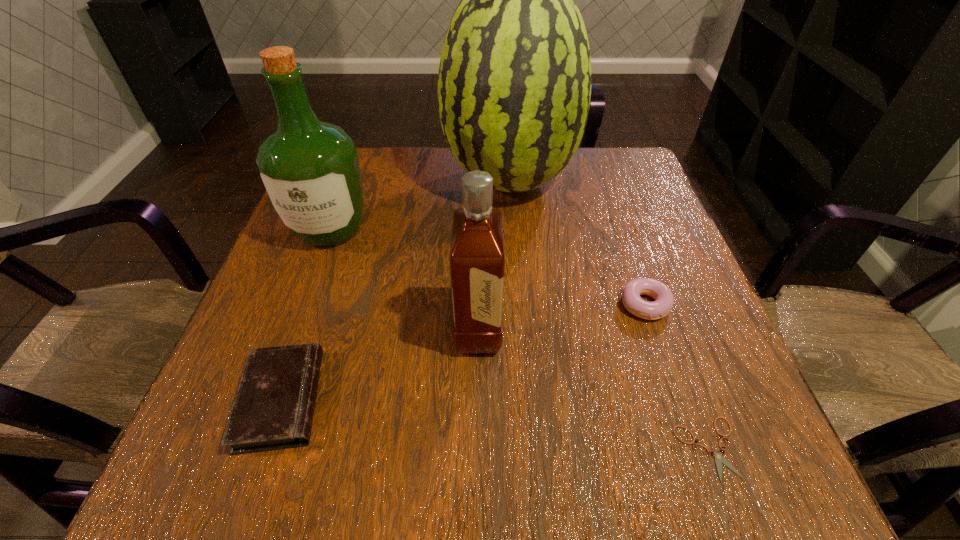
What are the coordinates of `vacant space that's between the doughnut and the right liquor` in the screenshot? It's located at (562, 318).

What are the coordinates of `empty location between the diary and the watermelon` in the screenshot? It's located at (396, 291).

Locate an element on the screen. This screenshot has height=540, width=960. free space that is in between the shears and the diary is located at coordinates (495, 424).

Find the location of a particular element. unoccupied area between the shortest object and the diary is located at coordinates (495, 424).

Where is `vacant area that lies between the taller liquor and the nearer liquor`? The height and width of the screenshot is (540, 960). vacant area that lies between the taller liquor and the nearer liquor is located at coordinates (404, 280).

Where is `the fifth closest object to the shortest object`? The width and height of the screenshot is (960, 540). the fifth closest object to the shortest object is located at coordinates (310, 169).

Locate which object ranks fourth in proximity to the diary. Please provide its 2D coordinates. Your answer should be formatted as a tuple, i.e. [(x, y)], where the tuple contains the x and y coordinates of a point satisfying the conditions above.

[(664, 299)]

This screenshot has width=960, height=540. In order to click on vacant space that satisfies the following two spatial constraints: 1. on the front-facing side of the farther liquor; 2. on the right side of the doughnut in this screenshot , I will do `click(303, 305)`.

This screenshot has width=960, height=540. I want to click on vacant space that satisfies the following two spatial constraints: 1. on the front-facing side of the shortest object; 2. on the right side of the left liquor, so click(x=251, y=449).

Find the location of a particular element. free space in the image that satisfies the following two spatial constraints: 1. on the front side of the watermelon; 2. on the front label of the right liquor is located at coordinates (520, 330).